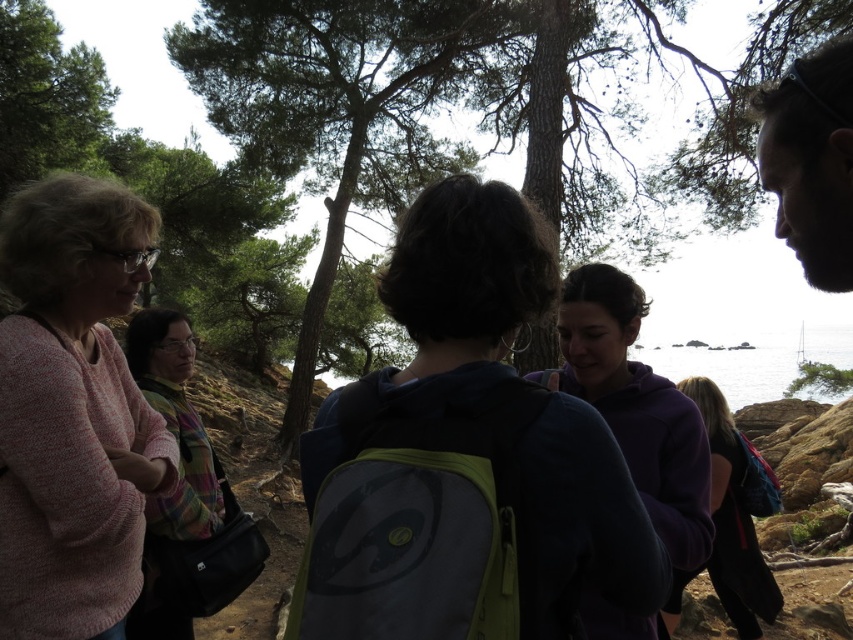
You are standing at point (675,595) and want to walk to the nearest tree. There is another point at (463,444) in front of you. Is the tree closer to your current position or to the point in front of you?

The tree is closer to the point (463,444) in front of you because point (463,444) is in front of point (675,595), so the tree would be closer to the point ahead of your current position.

You are standing at the center of the image and want to find the dark blue hoodie at center. In which direction should you look to see it?

The dark blue hoodie at center is located at point (465, 456), so you should look slightly to the right and down from the center to find it.

You are planning to cross the clear water at center to reach the green textured tree at center. Given that the distance between them is 32.99 meters, and you can only swim 20 meters before needing to rest, how many rest stops will you need to make?

The distance between the green textured tree at center and clear water at center is 32.99 meters. Since you can swim 20 meters before needing to rest, you would need to stop and rest twice. After the first 20 meters, you would have 12.99 meters remaining, requiring a second rest stop before reaching the tree.